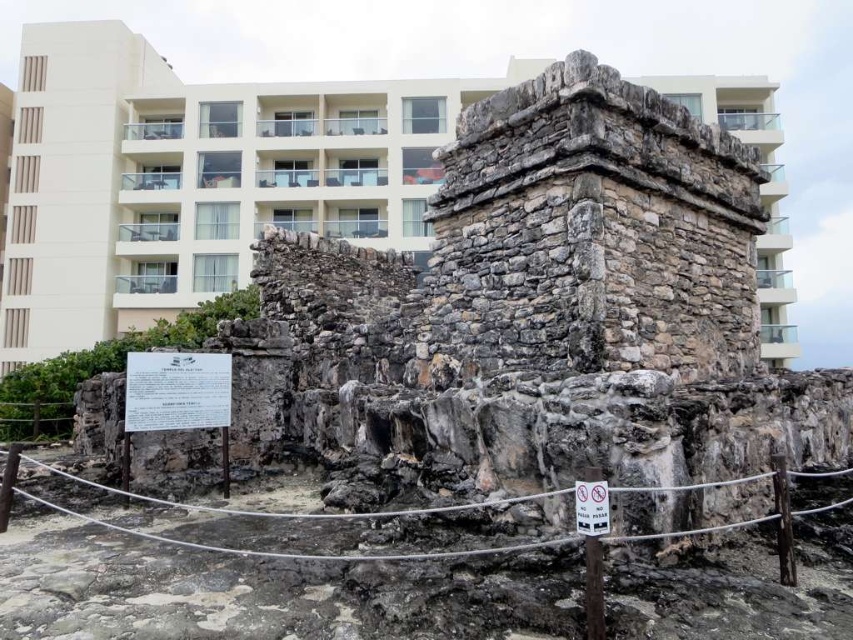
Can you confirm if white paper sign at center is bigger than white plastic sign at center?

Yes.

Who is lower down, white paper sign at center or white plastic sign at center?

white plastic sign at center

Locate an element on the screen. Image resolution: width=853 pixels, height=640 pixels. white paper sign at center is located at coordinates (177, 390).

Is beige concrete building at upper center closer to the viewer compared to white plastic sign at center?

No, it is not.

Does beige concrete building at upper center have a smaller size compared to white plastic sign at center?

No, beige concrete building at upper center is not smaller than white plastic sign at center.

Is point (109, 49) positioned behind point (589, 497)?

Yes, point (109, 49) is behind point (589, 497).

The image size is (853, 640). In order to click on beige concrete building at upper center in this screenshot , I will do `click(193, 179)`.

Between beige concrete building at upper center and white paper sign at center, which one appears on the left side from the viewer's perspective?

From the viewer's perspective, white paper sign at center appears more on the left side.

Can you confirm if beige concrete building at upper center is positioned below white paper sign at center?

Incorrect, beige concrete building at upper center is not positioned below white paper sign at center.

Does point (45, 48) come farther from viewer compared to point (187, 417)?

Yes, it is.

The height and width of the screenshot is (640, 853). I want to click on beige concrete building at upper center, so click(x=193, y=179).